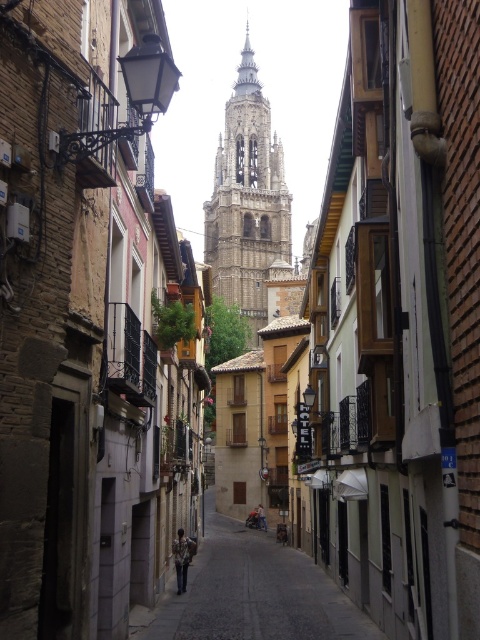
Based on the photo, you are a tourist walking down the street and want to take a photo of both the smooth stone pavement at center and the golden stone tower at center. Which object should you stand closer to in order to capture both in your shot?

You should stand closer to the smooth stone pavement at center because it is thinner than the golden stone tower at center, allowing both to fit within the frame more easily.

You are a tourist walking down the street and want to take a photo of the golden stone tower at center. To get a clear shot, you need to stand on the smooth stone pavement at center. Based on their positions, which direction should you move to face the tower?

The smooth stone pavement at center is positioned on the left side of the golden stone tower at center, so you should move to your right to face the tower.